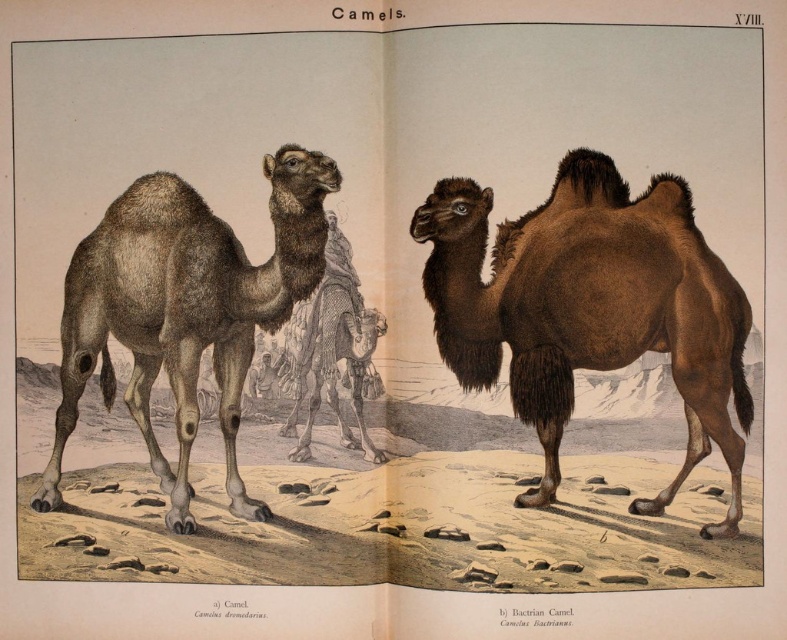
You are an explorer in the desert and see two brown fuzzy camels. You need to find the one on the right to follow its tracks. Which one should you choose between the brown fuzzy camel at left and the brown fuzzy camel at center?

The brown fuzzy camel at center is on the right side, so you should choose the brown fuzzy camel at center to follow its tracks.

You are an explorer in the desert and see the brown fuzzy bactrian camel at center and the brown fuzzy camel at left. Which camel is positioned lower in the image?

The brown fuzzy bactrian camel at center is located below the brown fuzzy camel at left, so it is positioned lower in the image.